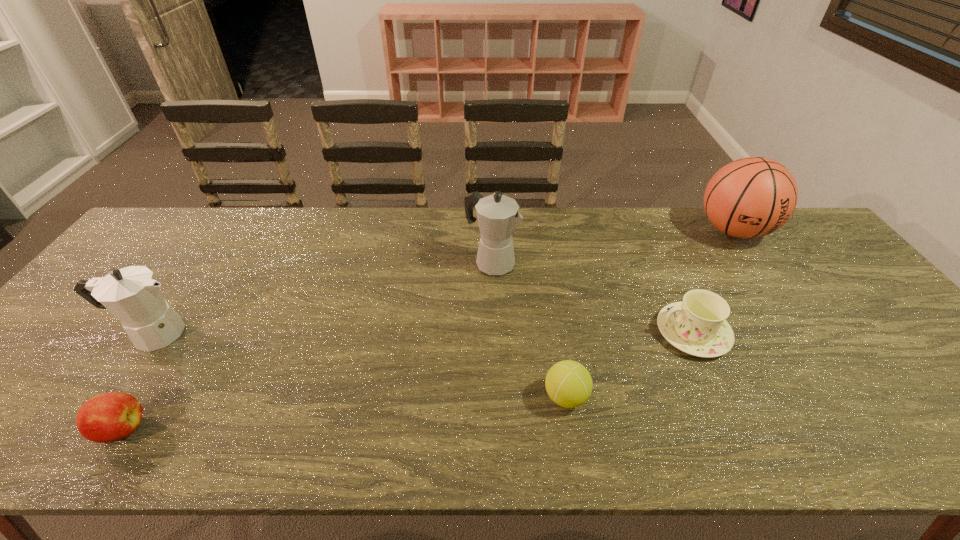
You are a GUI agent. You are given a task and a screenshot of the screen. Output one action in this format:
    pyautogui.click(x=<x>, y=<y>)
    Task: Click on the object present at the right edge
    This screenshot has width=960, height=540.
    Given the screenshot: What is the action you would take?
    pyautogui.click(x=751, y=197)

In order to click on object positioned at the far right corner in this screenshot , I will do 751,197.

At what (x,y) coordinates should I click in order to perform the action: click on vacant space at the far edge. Please return your answer as a coordinate pair (x, y). The height and width of the screenshot is (540, 960). Looking at the image, I should click on (432, 217).

Where is `vacant point at the near edge`? vacant point at the near edge is located at coordinates coord(538,426).

Find the location of a particular element. The width and height of the screenshot is (960, 540). vacant space at the right edge of the desktop is located at coordinates (851, 302).

Identify the location of vacant area at the far left corner. The height and width of the screenshot is (540, 960). (192, 208).

In the image, there is a desktop. Identify the location of free region at the near left corner. The width and height of the screenshot is (960, 540). (36, 421).

You are a GUI agent. You are given a task and a screenshot of the screen. Output one action in this format:
    pyautogui.click(x=<x>, y=<y>)
    Task: Click on the free space between the basketball and the fourth object from left to right
    This screenshot has width=960, height=540.
    Given the screenshot: What is the action you would take?
    pyautogui.click(x=650, y=314)

Where is `free space between the nearer coffeepot and the third object from left to right`? This screenshot has height=540, width=960. free space between the nearer coffeepot and the third object from left to right is located at coordinates (322, 298).

At what (x,y) coordinates should I click in order to perform the action: click on empty space that is in between the apple and the rightmost object. Please return your answer as a coordinate pair (x, y). The image size is (960, 540). Looking at the image, I should click on pos(428,330).